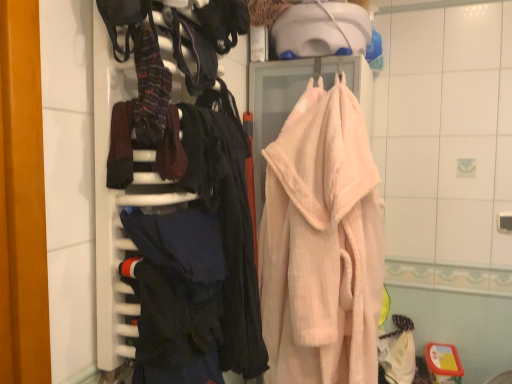
Question: Relative to dark blue fabric at left, is pink fluffy bathrobe at center in front or behind?

Choices:
 (A) behind
 (B) front

Answer: (A)

Question: Is pink fluffy bathrobe at center taller or shorter than dark blue fabric at left?

Choices:
 (A) short
 (B) tall

Answer: (B)

Question: Which of these objects is positioned closest to the dark blue fabric at left?

Choices:
 (A) striped wool socks at upper left, placed as the 1th clothing when sorted from top to bottom
 (B) pink fluffy bathrobe at center
 (C) dark blue fabric at center, the 1th clothing in the bottom-to-top sequence

Answer: (C)

Question: Which object is positioned closest to the striped wool socks at upper left, placed as the 1th clothing when sorted from top to bottom?

Choices:
 (A) dark blue fabric at center, the second clothing viewed from the top
 (B) dark blue fabric at left
 (C) pink fluffy bathrobe at center

Answer: (B)